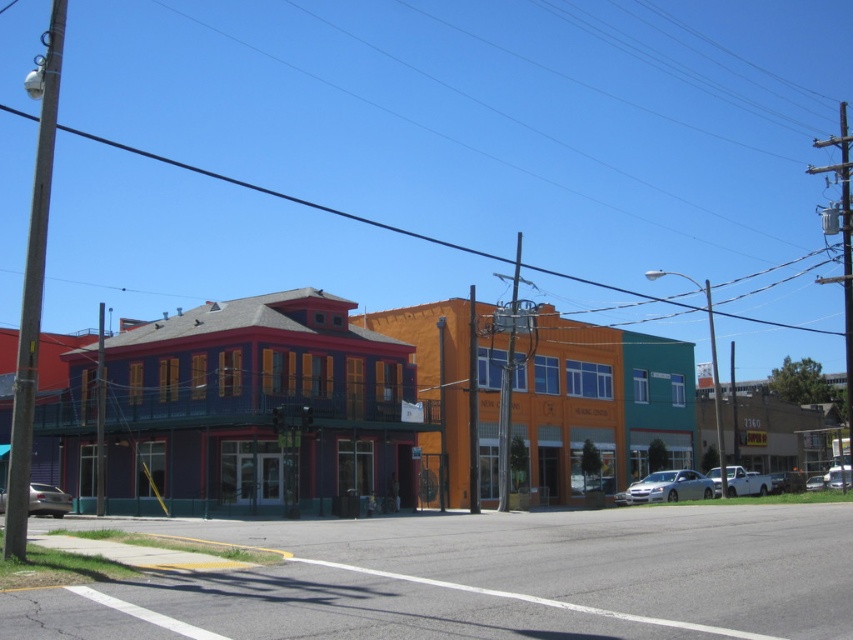
Is asphalt road at lower center wider than metallic silver car at lower left?

Yes.

Does asphalt road at lower center have a larger size compared to metallic silver car at lower left?

Actually, asphalt road at lower center might be smaller than metallic silver car at lower left.

Between point (229, 598) and point (42, 492), which one is positioned behind?

Point (42, 492)

At what (x,y) coordinates should I click in order to perform the action: click on asphalt road at lower center. Please return your answer as a coordinate pair (x, y). This screenshot has height=640, width=853. Looking at the image, I should click on (489, 579).

Can you confirm if purple matte building at left is shorter than silver metallic sedan at center?

Incorrect, purple matte building at left's height does not fall short of silver metallic sedan at center's.

Does purple matte building at left have a smaller size compared to silver metallic sedan at center?

No.

Where is `purple matte building at left`? purple matte building at left is located at coordinates (234, 406).

Who is higher up, purple matte building at left or shiny silver sedan at lower right?

purple matte building at left is above.

Who is more forward, (x=115, y=465) or (x=817, y=483)?

Point (x=115, y=465)

Locate an element on the screen. The width and height of the screenshot is (853, 640). purple matte building at left is located at coordinates (234, 406).